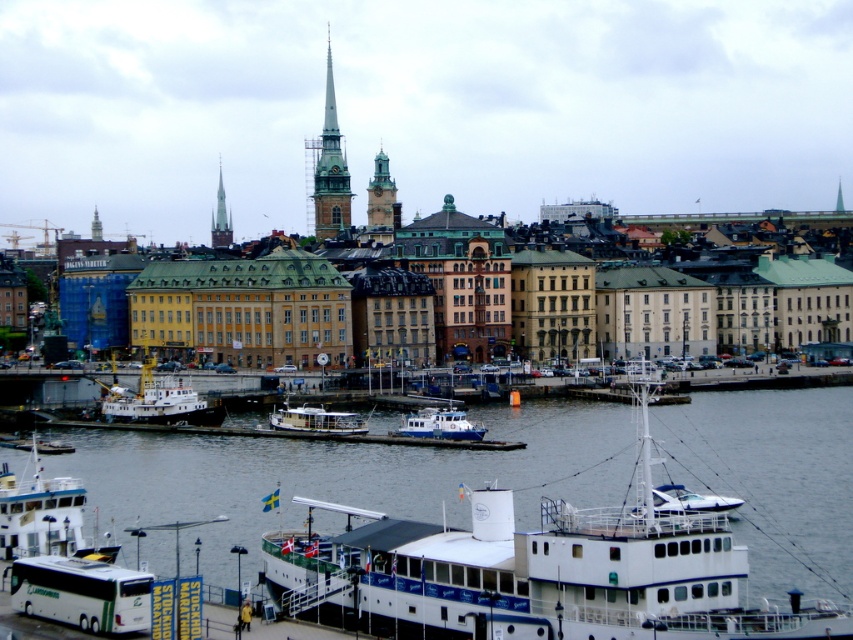
Is wooden polished boat at center positioned before white glossy speedboat at lower right?

No, wooden polished boat at center is further to the viewer.

Who is higher up, wooden polished boat at center or white glossy speedboat at lower right?

wooden polished boat at center

Image resolution: width=853 pixels, height=640 pixels. What are the coordinates of `wooden polished boat at center` in the screenshot? It's located at (317, 420).

Which of these two, white matte tugboat at lower left or white plastic boat at center, stands shorter?

Standing shorter between the two is white plastic boat at center.

Based on the photo, is white matte tugboat at lower left to the left of white plastic boat at center from the viewer's perspective?

Indeed, white matte tugboat at lower left is positioned on the left side of white plastic boat at center.

Between point (202, 420) and point (479, 435), which one is positioned behind?

The point (202, 420) is more distant.

The width and height of the screenshot is (853, 640). In order to click on white matte tugboat at lower left in this screenshot , I will do `click(160, 401)`.

Who is higher up, white matte bus at lower left or smooth white spire at center?

smooth white spire at center is higher up.

Who is lower down, white matte bus at lower left or smooth white spire at center?

white matte bus at lower left

What do you see at coordinates (80, 593) in the screenshot? Image resolution: width=853 pixels, height=640 pixels. I see `white matte bus at lower left` at bounding box center [80, 593].

Identify the location of white matte bus at lower left. The height and width of the screenshot is (640, 853). (80, 593).